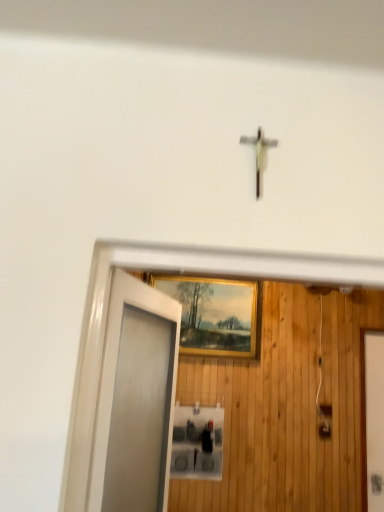
Question: From a real-world perspective, is frosted glass door at left located beneath gold-framed painting at center?

Choices:
 (A) no
 (B) yes

Answer: (B)

Question: Is frosted glass door at left further to camera compared to gold-framed painting at center?

Choices:
 (A) yes
 (B) no

Answer: (B)

Question: Considering the relative sizes of frosted glass door at left and gold-framed painting at center in the image provided, is frosted glass door at left thinner than gold-framed painting at center?

Choices:
 (A) no
 (B) yes

Answer: (A)

Question: Is frosted glass door at left positioned far away from gold-framed painting at center?

Choices:
 (A) no
 (B) yes

Answer: (B)

Question: Does frosted glass door at left have a larger size compared to gold-framed painting at center?

Choices:
 (A) no
 (B) yes

Answer: (B)

Question: From the image's perspective, is white glossy elevator door at right above or below frosted glass door at left?

Choices:
 (A) below
 (B) above

Answer: (A)

Question: Do you think white glossy elevator door at right is within frosted glass door at left, or outside of it?

Choices:
 (A) outside
 (B) inside

Answer: (A)

Question: Is white glossy elevator door at right in front of or behind frosted glass door at left in the image?

Choices:
 (A) behind
 (B) front

Answer: (A)

Question: Based on their positions, is white glossy elevator door at right located to the left or right of frosted glass door at left?

Choices:
 (A) right
 (B) left

Answer: (A)

Question: From a real-world perspective, is frosted glass door at left positioned above or below gold-framed painting at center?

Choices:
 (A) below
 (B) above

Answer: (A)

Question: Is frosted glass door at left inside or outside of gold-framed painting at center?

Choices:
 (A) inside
 (B) outside

Answer: (B)

Question: Relative to gold-framed painting at center, is frosted glass door at left in front or behind?

Choices:
 (A) front
 (B) behind

Answer: (A)

Question: In terms of width, does frosted glass door at left look wider or thinner when compared to gold-framed painting at center?

Choices:
 (A) wide
 (B) thin

Answer: (A)

Question: Considering the relative positions of frosted glass door at left and white glossy elevator door at right in the image provided, is frosted glass door at left to the left or to the right of white glossy elevator door at right?

Choices:
 (A) right
 (B) left

Answer: (B)

Question: Does point (120, 452) appear closer or farther from the camera than point (382, 384)?

Choices:
 (A) farther
 (B) closer

Answer: (B)